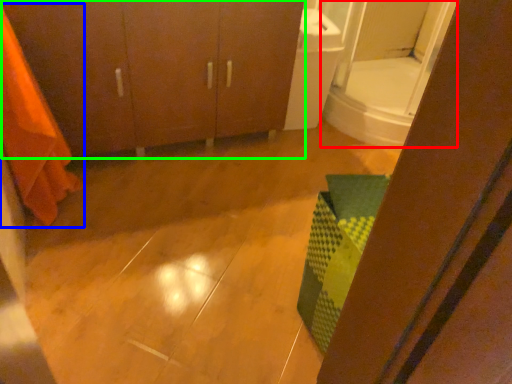
Question: Which is farther away from mirror (highlighted by a red box)? shower curtain (highlighted by a blue box) or bathroom cabinet (highlighted by a green box)?

Choices:
 (A) shower curtain
 (B) bathroom cabinet

Answer: (A)